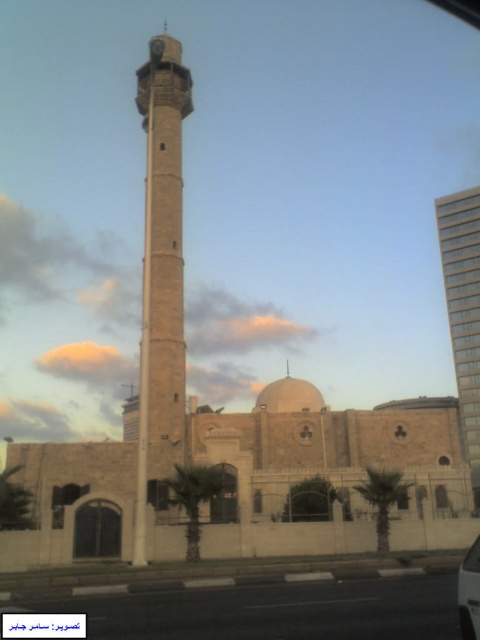
Question: Which object appears closest to the camera in this image?

Choices:
 (A) green leafy palm tree at lower center
 (B) transparent plastic car window at lower right
 (C) beige stone minaret at center

Answer: (B)

Question: Which point is farther to the camera?

Choices:
 (A) green leafy palm tree at lower right
 (B) green leafy palm tree at lower center
 (C) glassy reflective skyscraper at right

Answer: (C)

Question: Can you confirm if glassy reflective skyscraper at right is thinner than transparent plastic car window at lower right?

Choices:
 (A) yes
 (B) no

Answer: (B)

Question: Which object is closer to the camera taking this photo?

Choices:
 (A) transparent plastic car window at lower right
 (B) beige stone minaret at center

Answer: (A)

Question: Does metallic silver car at center come in front of transparent plastic car window at lower right?

Choices:
 (A) no
 (B) yes

Answer: (B)

Question: Is beige stone minaret at center thinner than green leafy palm tree at lower center?

Choices:
 (A) no
 (B) yes

Answer: (A)